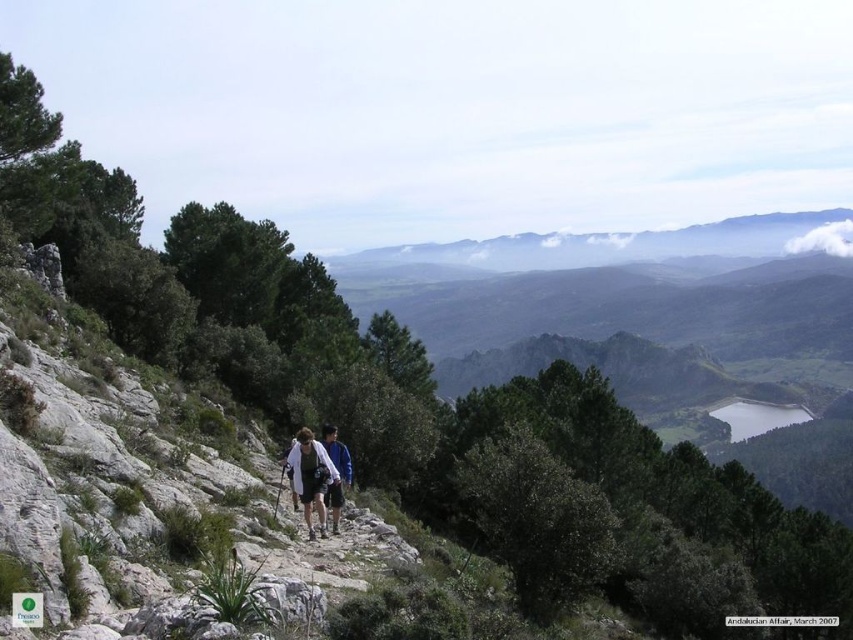
Which is above, white fabric jacket at center or blue fabric jacket at center?

blue fabric jacket at center

Which is in front, point (299, 486) or point (328, 428)?

Point (299, 486) is in front.

Identify the location of white fabric jacket at center. Image resolution: width=853 pixels, height=640 pixels. (312, 477).